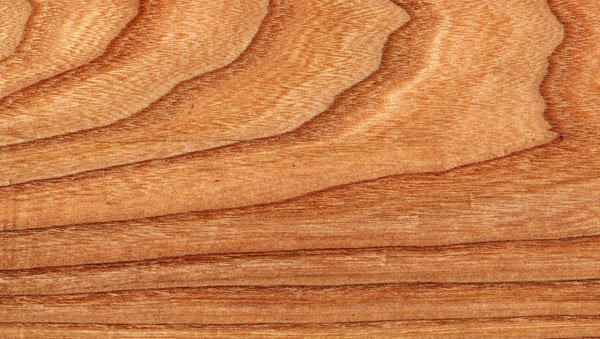
Locate an element on the screen. The height and width of the screenshot is (339, 600). wood surface is located at coordinates (208, 214).